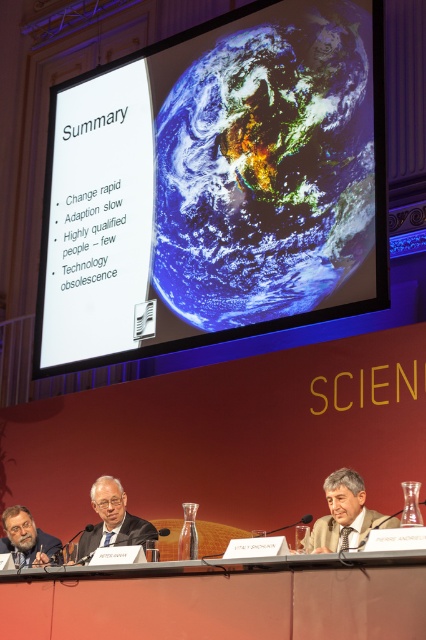
You are an event organizer who needs to adjust seating arrangements. The current setup has the matte black man at center and the matte black suit at center seated next to each other. Based on their physical dimensions, which one requires a wider chair to accommodate comfortably?

The matte black suit at center requires a wider chair because it is thicker than the matte black man at center.

You are an attendee at the presentation and need to place a 20 cm wide notebook on the table. Can the white paper at center and the matte wood table at lower center accommodate it without overlapping?

The white paper at center is 18.52 meters away from the matte wood table at lower center. Since the distance between them is much larger than the notebook size, placing the notebook on either the white paper at center or the matte wood table at lower center would not cause overlap. However, the white paper at center might be too small to fit the notebook if it is only 20 cm wide, but the matte wood table at lower center likely has enough space.